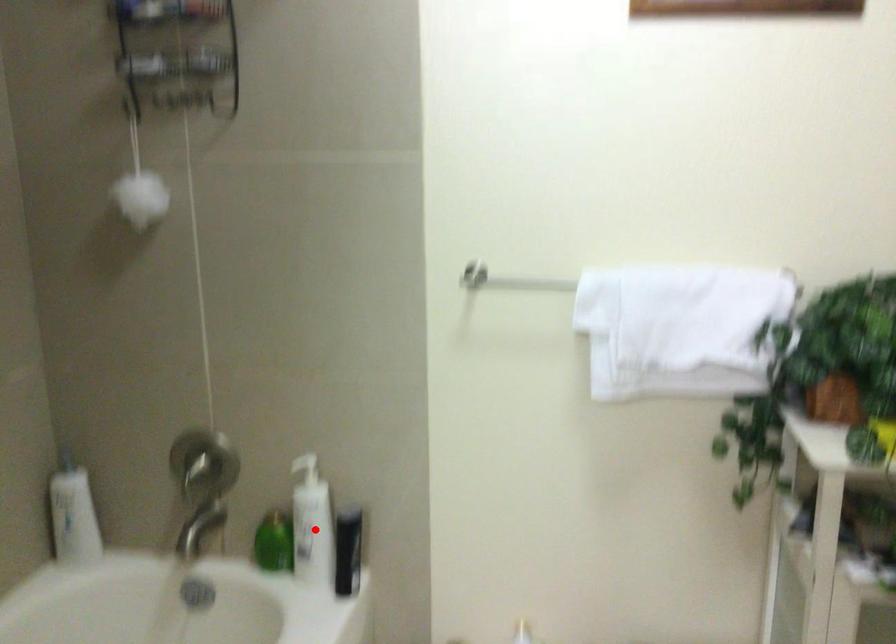
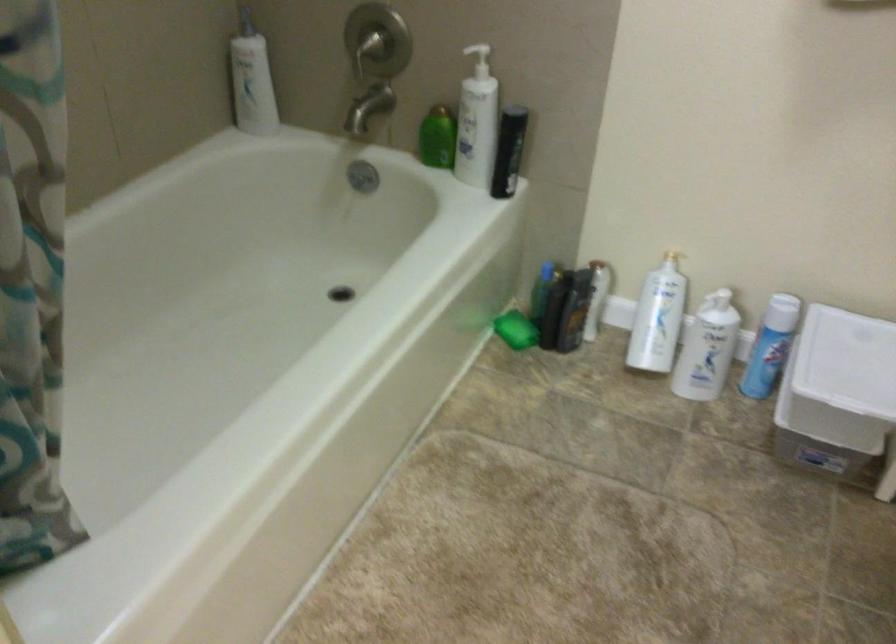
Question: I am providing you with two images of the same scene from different viewpoints. A red point is marked on the first image. At the location where the point appears in image 1, is it still visible in image 2?

Choices:
 (A) Yes
 (B) No

Answer: (A)